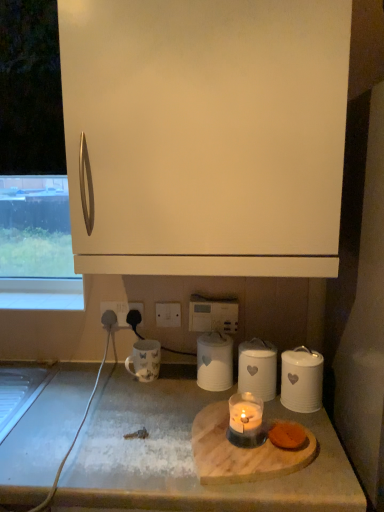
This screenshot has height=512, width=384. In order to click on unoccupied region to the right of white glossy mug at lower left in this screenshot , I will do [180, 384].